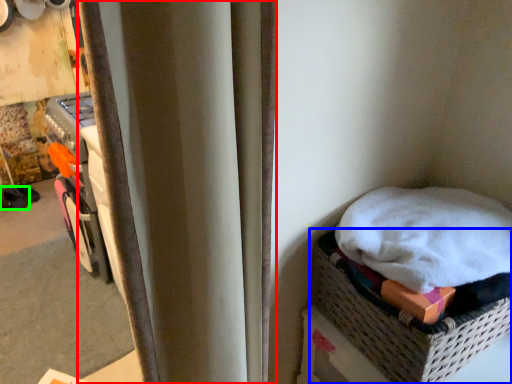
Question: Which is nearer to the curtain (highlighted by a red box)? basket (highlighted by a blue box) or footwear (highlighted by a green box).

Choices:
 (A) basket
 (B) footwear

Answer: (A)